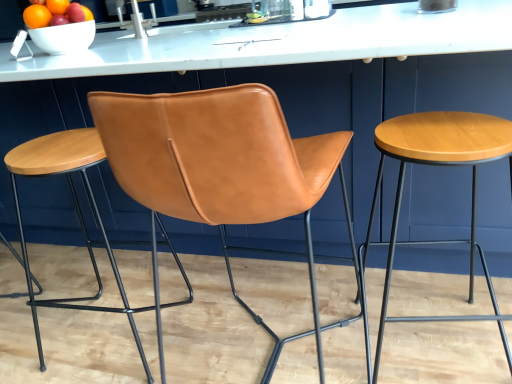
Question: From the image's perspective, is white glossy bowl at upper left located above or below wooden stool at right, arranged as the 2th stool when viewed from the left?

Choices:
 (A) below
 (B) above

Answer: (B)

Question: Considering the relative positions of white glossy bowl at upper left and wooden stool at right, arranged as the 2th stool when viewed from the left, in the image provided, is white glossy bowl at upper left to the left or to the right of wooden stool at right, arranged as the 2th stool when viewed from the left,?

Choices:
 (A) right
 (B) left

Answer: (B)

Question: Which is nearer to the saddle brown leather stool at center, which is the 1th stool in left-to-right order?

Choices:
 (A) shiny ceramic bowl at upper left
 (B) wooden stool at right, arranged as the 2th stool when viewed from the left
 (C) cognac leather chair at center
 (D) white glossy bowl at upper left

Answer: (D)

Question: Based on their relative distances, which object is farther from the white glossy bowl at upper left?

Choices:
 (A) shiny ceramic bowl at upper left
 (B) saddle brown leather stool at center, which ranks as the second stool in right-to-left order
 (C) cognac leather chair at center
 (D) wooden stool at right, arranged as the 2th stool when viewed from the left

Answer: (D)